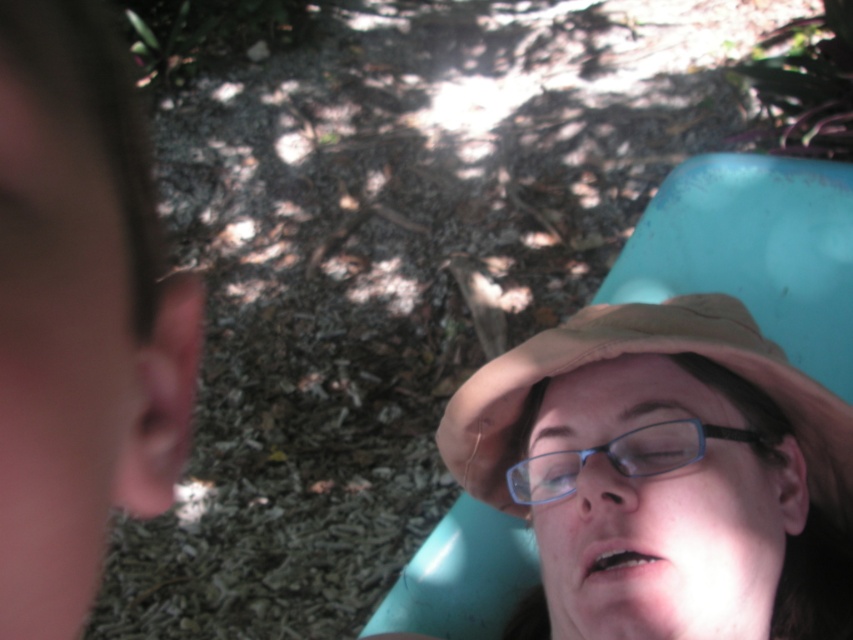
Between blurred skin ear at left and blue plastic glasses at center, which one has more height?

With more height is blurred skin ear at left.

Who is more distant from viewer, (25, 273) or (653, 428)?

Positioned behind is point (653, 428).

Which is in front, point (20, 61) or point (770, 445)?

Point (20, 61) is in front.

This screenshot has height=640, width=853. In order to click on blurred skin ear at left in this screenshot , I will do click(x=79, y=316).

Does point (136, 321) come behind point (834, 403)?

No, (136, 321) is closer to viewer.

Who is shorter, blurred skin ear at left or tan fabric hat at upper center?

blurred skin ear at left

Where is `blurred skin ear at left`? blurred skin ear at left is located at coordinates (79, 316).

Find the location of a particular element. This screenshot has width=853, height=640. blurred skin ear at left is located at coordinates (79, 316).

The height and width of the screenshot is (640, 853). What do you see at coordinates (643, 353) in the screenshot?
I see `tan fabric hat at upper center` at bounding box center [643, 353].

Which is in front, point (463, 438) or point (648, 428)?

Point (648, 428) is in front.

Is point (711, 326) positioned after point (604, 452)?

Yes, point (711, 326) is farther from viewer.

The width and height of the screenshot is (853, 640). Find the location of `tan fabric hat at upper center`. tan fabric hat at upper center is located at coordinates (643, 353).